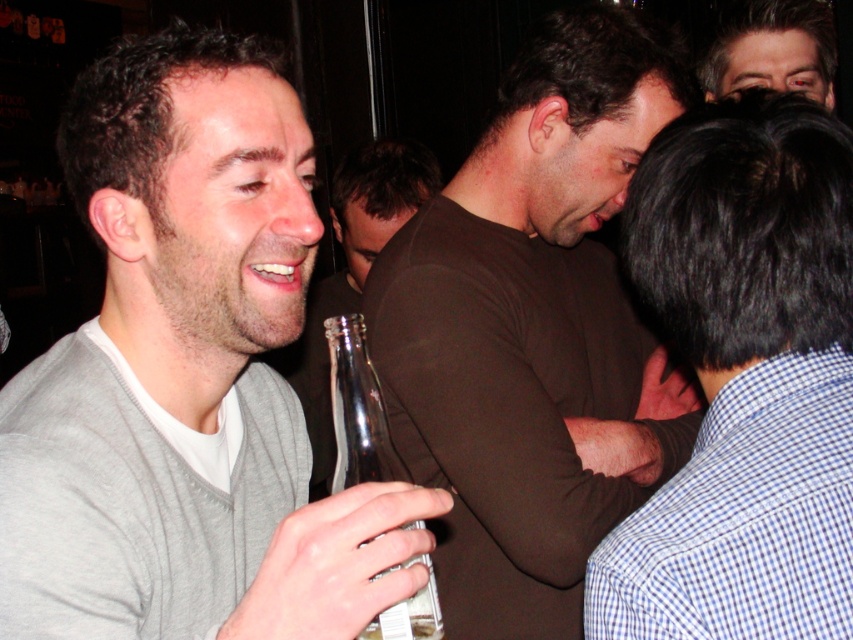
Based on the scene description, where is the gray sweater at center located in terms of its 2D coordinates?

The gray sweater at center is located at the 2D coordinates of point (187, 378).

You are a photographer at the event and want to ensure all attendees are visible in the group photo. If you position the gray sweater at center and the blue checkered shirt at center in the front row, which one should you place further back to avoid blocking the view?

The gray sweater at center is much taller than the blue checkered shirt at center, so you should place the gray sweater at center further back to avoid blocking the view.